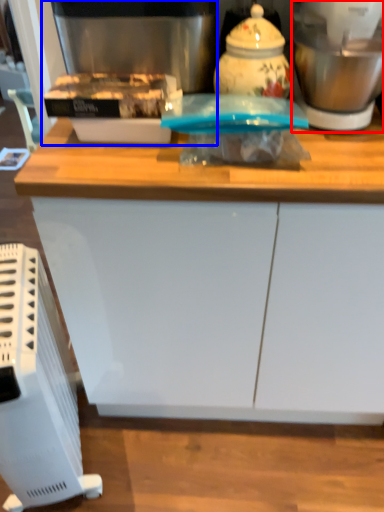
Question: Which object is further to the camera taking this photo, blender (highlighted by a red box) or coffee machine (highlighted by a blue box)?

Choices:
 (A) blender
 (B) coffee machine

Answer: (B)